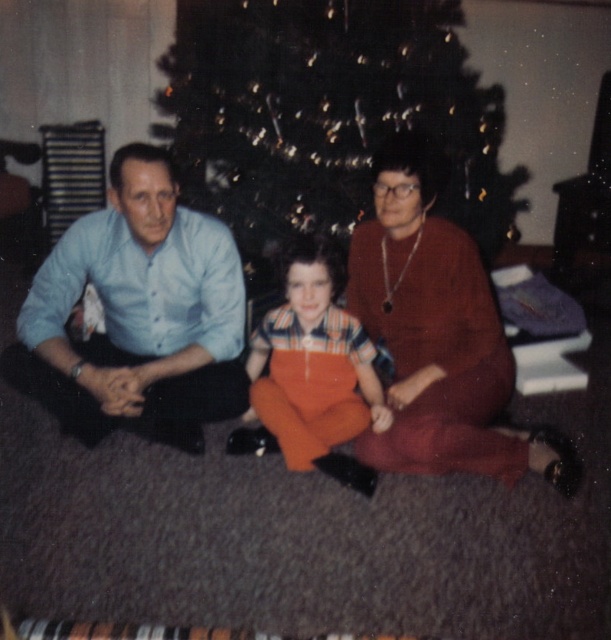
You are planning to place a new rectangular photo frame that is 1.2 meters wide on the wall behind the green textured christmas tree at center and the matte blue shirt at left. Considering their positions and the scene described, will the photo frame fit horizontally between the two objects?

The green textured christmas tree at center is narrower than the matte blue shirt at left, so the photo frame might not fit if placed between them. However, since the tree is at the center and the shirt is on the left, the total available space between them may still accommodate the frame depending on their exact positions. The description only provides relative width, not distance between them. Without knowing the distance between the two objects, it is impossible to determine if the 1.2 meter wide frame

You are planning to take a family photo and want to ensure that the green textured christmas tree at center and the matte blue shirt at left are both visible in the frame. Based on their sizes, which object should you prioritize positioning closer to the camera to maintain clarity?

The green textured christmas tree at center is bigger than the matte blue shirt at left, so you should prioritize positioning the matte blue shirt at left closer to the camera to maintain clarity since it is smaller and might be less visible if placed farther away.